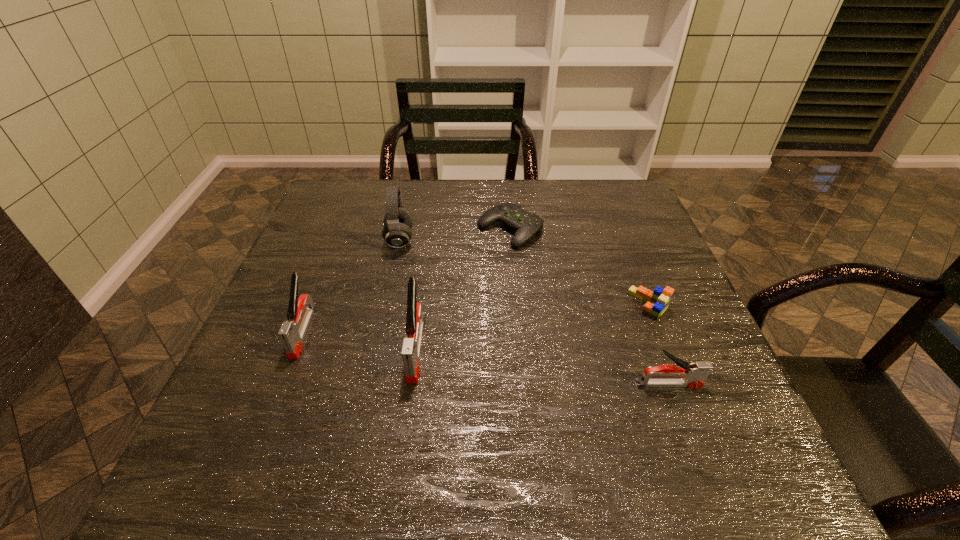
This screenshot has width=960, height=540. In order to click on free space for an extra stapler_(stapling_machine) to achieve even spacing in this screenshot , I will do `click(538, 365)`.